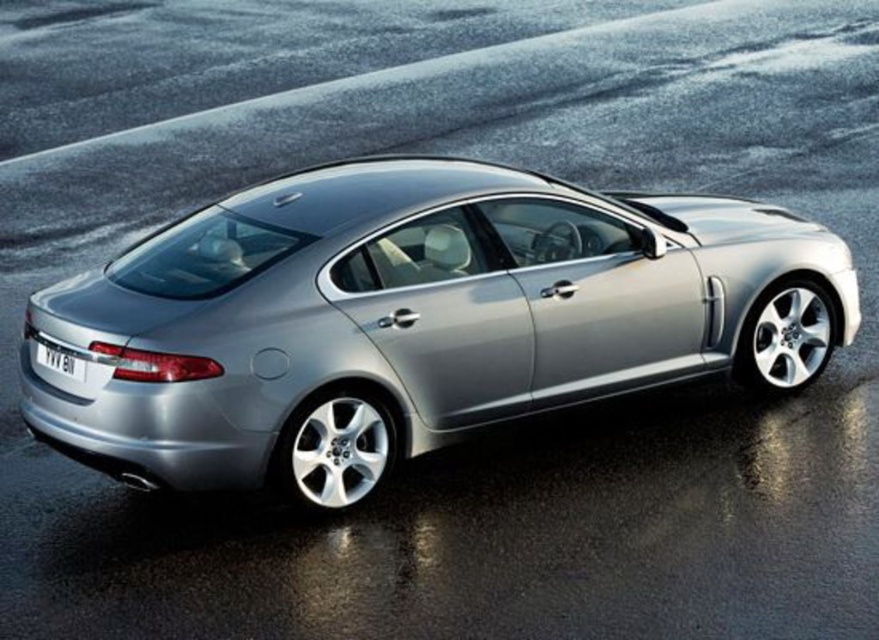
Question: Does satin silver car at center appear on the left side of black plastic license plate at lower center?

Choices:
 (A) yes
 (B) no

Answer: (B)

Question: Is satin silver car at center above black plastic license plate at lower center?

Choices:
 (A) no
 (B) yes

Answer: (B)

Question: Is satin silver car at center wider than black plastic license plate at lower center?

Choices:
 (A) no
 (B) yes

Answer: (B)

Question: Which object appears farthest from the camera in this image?

Choices:
 (A) satin silver car at center
 (B) black plastic license plate at lower center

Answer: (B)

Question: Among these points, which one is nearest to the camera?

Choices:
 (A) (52, 355)
 (B) (502, 310)

Answer: (A)

Question: Which point is farther to the camera?

Choices:
 (A) (360, 328)
 (B) (49, 349)

Answer: (B)